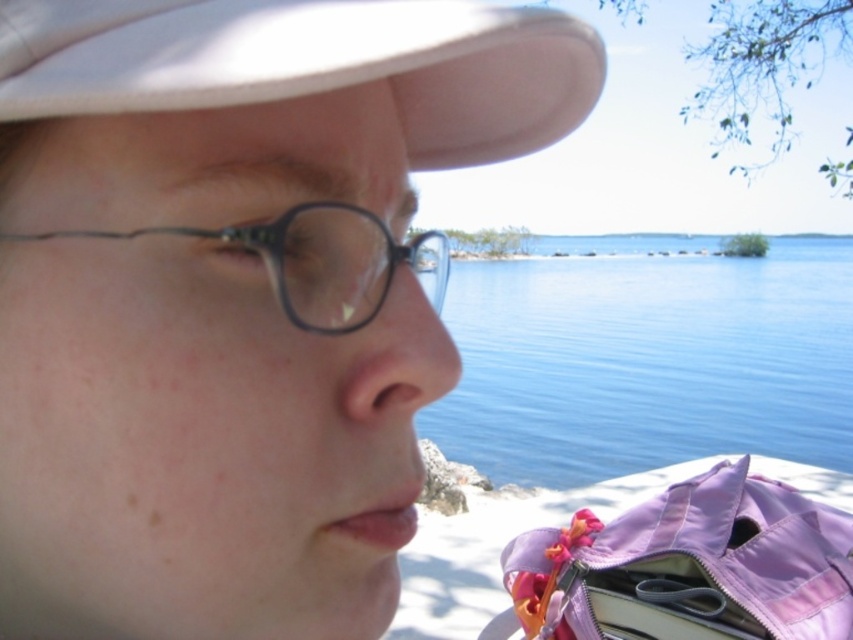
Question: Where is matte black glasses at center located in relation to black plastic glasses at left in the image?

Choices:
 (A) left
 (B) right

Answer: (A)

Question: Which point is farther to the camera?

Choices:
 (A) (274, 220)
 (B) (537, 396)
 (C) (343, 3)
 (D) (380, 627)

Answer: (B)

Question: Considering the real-world distances, which object is farthest from the matte black glasses at center?

Choices:
 (A) black plastic glasses at left
 (B) blue water at center

Answer: (B)

Question: From the image, what is the correct spatial relationship of matte black glasses at center in relation to black plastic glasses at left?

Choices:
 (A) right
 (B) left

Answer: (B)

Question: Which of the following is the closest to the observer?

Choices:
 (A) (822, 428)
 (B) (47, 51)
 (C) (219, 323)
 (D) (363, 228)

Answer: (B)

Question: Is blue water at center below white matte baseball cap at upper left?

Choices:
 (A) yes
 (B) no

Answer: (B)